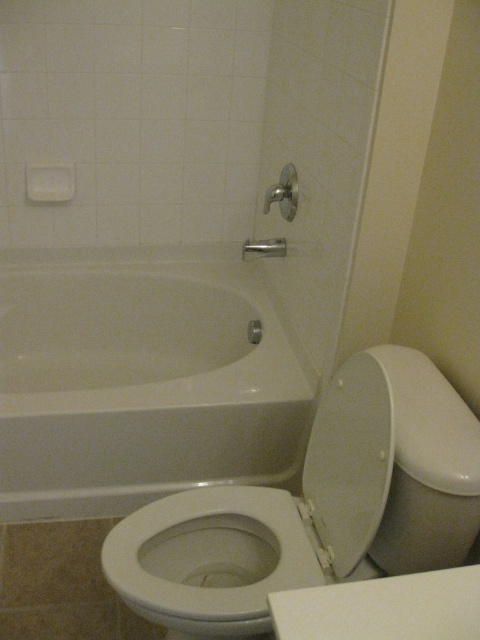
Find the location of a particular element. Image resolution: width=480 pixels, height=640 pixels. brushed metal faucet at upper center is located at coordinates (284, 193).

Does brushed metal faucet at upper center have a greater height compared to matte silver shower handle at upper center?

Correct, brushed metal faucet at upper center is much taller as matte silver shower handle at upper center.

Does point (283, 188) lie behind point (242, 253)?

That is False.

This screenshot has width=480, height=640. Identify the location of brushed metal faucet at upper center. (284, 193).

Is white glossy bathtub at center thinner than brushed metal faucet at upper center?

No.

Can you confirm if white glossy bathtub at center is wider than brushed metal faucet at upper center?

Yes, white glossy bathtub at center is wider than brushed metal faucet at upper center.

Is point (151, 461) more distant than point (287, 211)?

No, it is not.

This screenshot has width=480, height=640. Find the location of `white glossy bathtub at center`. white glossy bathtub at center is located at coordinates (142, 380).

Which is below, white glossy toilet at lower right or matte silver shower handle at upper center?

white glossy toilet at lower right is lower down.

Does white glossy toilet at lower right have a lesser width compared to matte silver shower handle at upper center?

Incorrect, white glossy toilet at lower right's width is not less than matte silver shower handle at upper center's.

Who is more forward, (439,497) or (260,243)?

Point (439,497) is in front.

In order to click on white glossy toilet at lower right in this screenshot , I will do `click(315, 506)`.